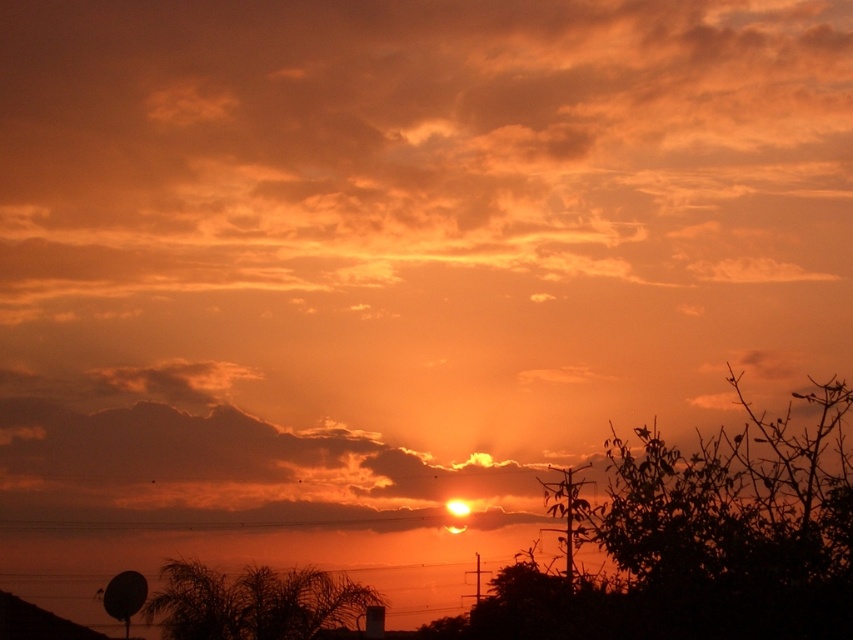
Question: Among these objects, which one is nearest to the camera?

Choices:
 (A) silhouette leafy tree at lower left
 (B) silhouette leafy tree at lower right

Answer: (B)

Question: Which of the following is the closest to the observer?

Choices:
 (A) silhouette leafy tree at lower right
 (B) silhouette leafy tree at lower left

Answer: (A)

Question: Can you confirm if silhouette leafy tree at lower right is positioned above silhouette leafy tree at lower left?

Choices:
 (A) no
 (B) yes

Answer: (B)

Question: Does silhouette leafy tree at lower right appear on the right side of silhouette leafy tree at lower left?

Choices:
 (A) no
 (B) yes

Answer: (B)

Question: Is silhouette leafy tree at lower right thinner than silhouette leafy tree at lower left?

Choices:
 (A) yes
 (B) no

Answer: (A)